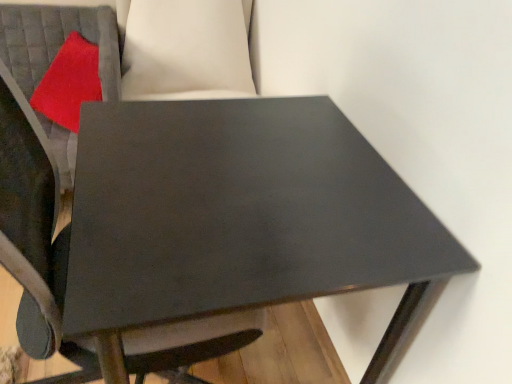
Image resolution: width=512 pixels, height=384 pixels. I want to click on red velvet pillow at upper left, so click(x=69, y=83).

What do you see at coordinates (69, 83) in the screenshot? I see `red velvet pillow at upper left` at bounding box center [69, 83].

Where is `matte black table at center`? matte black table at center is located at coordinates (241, 219).

This screenshot has width=512, height=384. What do you see at coordinates (241, 219) in the screenshot?
I see `matte black table at center` at bounding box center [241, 219].

Measure the distance between point (279, 297) and camera.

A distance of 26.42 inches exists between point (279, 297) and camera.

Where is `red velvet pillow at upper left`? This screenshot has height=384, width=512. red velvet pillow at upper left is located at coordinates (69, 83).

Considering the positions of objects matte black table at center and red velvet pillow at upper left in the image provided, who is more to the left, matte black table at center or red velvet pillow at upper left?

Positioned to the left is red velvet pillow at upper left.

Which object is further away from the camera, matte black table at center or red velvet pillow at upper left?

red velvet pillow at upper left is further from the camera.

Which is behind, point (111, 147) or point (65, 65)?

The point (65, 65) is farther from the camera.

From the picture: From the image's perspective, who appears lower, matte black table at center or red velvet pillow at upper left?

From the image's view, matte black table at center is below.

From the picture: From a real-world perspective, is matte black table at center positioned under red velvet pillow at upper left based on gravity?

Yes.

Can you confirm if matte black table at center is thinner than red velvet pillow at upper left?

No, matte black table at center is not thinner than red velvet pillow at upper left.

Considering the sizes of matte black table at center and red velvet pillow at upper left in the image, is matte black table at center taller or shorter than red velvet pillow at upper left?

matte black table at center is taller than red velvet pillow at upper left.

Is matte black table at center bigger or smaller than red velvet pillow at upper left?

Clearly, matte black table at center is larger in size than red velvet pillow at upper left.

Would you say red velvet pillow at upper left is part of matte black table at center's contents?

That's incorrect, red velvet pillow at upper left is not inside matte black table at center.

From the picture: Is matte black table at center in contact with red velvet pillow at upper left?

matte black table at center is not next to red velvet pillow at upper left, and they're not touching.

Is matte black table at center facing away from red velvet pillow at upper left?

That's not correct — matte black table at center is not looking away from red velvet pillow at upper left.

Measure the distance between matte black table at center and red velvet pillow at upper left.

matte black table at center is 92.53 centimeters away from red velvet pillow at upper left.

Find the location of a particular element. This screenshot has height=384, width=512. table below the red velvet pillow at upper left (from the image's perspective) is located at coordinates (241, 219).

Is red velvet pillow at upper left at the right side of matte black table at center?

Incorrect, red velvet pillow at upper left is not on the right side of matte black table at center.

Between red velvet pillow at upper left and matte black table at center, which one is positioned behind?

red velvet pillow at upper left is behind.

Is point (70, 47) less distant than point (276, 271)?

No, (70, 47) is further to viewer.

From the image's perspective, is red velvet pillow at upper left below matte black table at center?

No, from the image's perspective, red velvet pillow at upper left is not below matte black table at center.

From a real-world perspective, who is located higher, red velvet pillow at upper left or matte black table at center?

From a 3D spatial view, red velvet pillow at upper left is above.

In terms of width, does red velvet pillow at upper left look wider or thinner when compared to matte black table at center?

Considering their sizes, red velvet pillow at upper left looks slimmer than matte black table at center.

Consider the image. Which of these two, red velvet pillow at upper left or matte black table at center, stands shorter?

red velvet pillow at upper left is shorter.

Considering the relative sizes of red velvet pillow at upper left and matte black table at center in the image provided, is red velvet pillow at upper left smaller than matte black table at center?

Yes, red velvet pillow at upper left is smaller than matte black table at center.

Is red velvet pillow at upper left surrounding matte black table at center?

That's incorrect, matte black table at center is not inside red velvet pillow at upper left.

Would you say red velvet pillow at upper left is a long distance from matte black table at center?

They are positioned close to each other.

Is red velvet pillow at upper left facing away from matte black table at center?

red velvet pillow at upper left does not have its back to matte black table at center.

How far apart are red velvet pillow at upper left and matte black table at center?

red velvet pillow at upper left is 92.53 centimeters away from matte black table at center.

Where is `pillow above the matte black table at center (from a real-world perspective)`? The image size is (512, 384). pillow above the matte black table at center (from a real-world perspective) is located at coordinates (69, 83).

Identify the location of pillow lying above the matte black table at center (from the image's perspective). Image resolution: width=512 pixels, height=384 pixels. (69, 83).

At what (x,y) coordinates should I click in order to perform the action: click on table in front of the red velvet pillow at upper left. Please return your answer as a coordinate pair (x, y). The image size is (512, 384). Looking at the image, I should click on (241, 219).